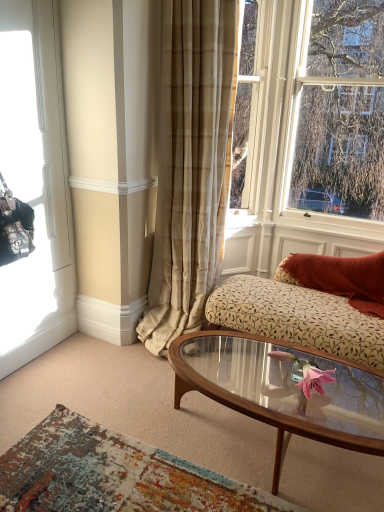
Describe the element at coordinates (35, 183) in the screenshot. I see `black leather handbag at left, the second window when ordered from right to left` at that location.

Locate an element on the screen. Image resolution: width=384 pixels, height=512 pixels. floral-patterned fabric couch at right is located at coordinates (310, 305).

The image size is (384, 512). Describe the element at coordinates (306, 372) in the screenshot. I see `pink glass flower at center` at that location.

Image resolution: width=384 pixels, height=512 pixels. I want to click on black leather handbag at left, positioned as the 1th window in left-to-right order, so click(35, 183).

Could you tell me if black leather handbag at left, positioned as the 1th window in left-to-right order, is facing beige plaid curtain at center?

No, black leather handbag at left, positioned as the 1th window in left-to-right order, is not turned towards beige plaid curtain at center.

At what (x,y) coordinates should I click in order to perform the action: click on curtain that is below the black leather handbag at left, positioned as the 1th window in left-to-right order (from the image's perspective). Please return your answer as a coordinate pair (x, y). The image size is (384, 512). Looking at the image, I should click on (191, 165).

Between black leather handbag at left, the second window when ordered from right to left, and beige plaid curtain at center, which one has larger size?

black leather handbag at left, the second window when ordered from right to left.

Is black leather handbag at left, the second window when ordered from right to left, situated inside beige plaid curtain at center or outside?

black leather handbag at left, the second window when ordered from right to left, exists outside the volume of beige plaid curtain at center.

Is point (350, 207) positioned in front of point (161, 460)?

No, (350, 207) is further to viewer.

Is clear glass window at upper right, the first window in the right-to-left sequence, oriented towards distressed rug at lower left?

Yes, clear glass window at upper right, the first window in the right-to-left sequence, is facing distressed rug at lower left.

Is the depth of clear glass window at upper right, which appears as the second window when viewed from the left, less than that of distressed rug at lower left?

No, it is not.

Are wooden glass coffee table at center and black leather handbag at left, the second window when ordered from right to left, making contact?

No, wooden glass coffee table at center is not beside black leather handbag at left, the second window when ordered from right to left.

Find the location of a particular element. the 1st window directly above the wooden glass coffee table at center (from a real-world perspective) is located at coordinates (35, 183).

Can you confirm if wooden glass coffee table at center is bigger than black leather handbag at left, the second window when ordered from right to left?

No.

Is wooden glass coffee table at center to the left or to the right of black leather handbag at left, the second window when ordered from right to left, in the image?

In the image, wooden glass coffee table at center appears on the right side of black leather handbag at left, the second window when ordered from right to left.

Between pink glass flower at center and clear glass window at upper right, the first window in the right-to-left sequence, which one is positioned behind?

clear glass window at upper right, the first window in the right-to-left sequence, is further away from the camera.

Based on the photo, from the image's perspective, which object appears higher, pink glass flower at center or clear glass window at upper right, which appears as the second window when viewed from the left?

clear glass window at upper right, which appears as the second window when viewed from the left, from the image's perspective.

Considering the sizes of objects pink glass flower at center and clear glass window at upper right, which appears as the second window when viewed from the left, in the image provided, who is thinner, pink glass flower at center or clear glass window at upper right, which appears as the second window when viewed from the left,?

With smaller width is clear glass window at upper right, which appears as the second window when viewed from the left.

Is pink glass flower at center at the right side of clear glass window at upper right, which appears as the second window when viewed from the left?

No.

Is wooden glass coffee table at center thinner than pink glass flower at center?

In fact, wooden glass coffee table at center might be wider than pink glass flower at center.

Is wooden glass coffee table at center taller than pink glass flower at center?

Yes.

How different are the orientations of wooden glass coffee table at center and pink glass flower at center in degrees?

wooden glass coffee table at center and pink glass flower at center are facing 1.56 degrees away from each other.

Choose the correct answer: Is wooden glass coffee table at center inside pink glass flower at center or outside it?

wooden glass coffee table at center is spatially situated outside pink glass flower at center.

Between clear glass window at upper right, which appears as the second window when viewed from the left, and wooden glass coffee table at center, which one has larger size?

With larger size is clear glass window at upper right, which appears as the second window when viewed from the left.

From the picture: Is clear glass window at upper right, which appears as the second window when viewed from the left, taller than wooden glass coffee table at center?

Indeed, clear glass window at upper right, which appears as the second window when viewed from the left, has a greater height compared to wooden glass coffee table at center.

In the scene shown: Is clear glass window at upper right, the first window in the right-to-left sequence, not near wooden glass coffee table at center?

clear glass window at upper right, the first window in the right-to-left sequence, is positioned a significant distance from wooden glass coffee table at center.

Considering the points (353, 183) and (355, 445), which point is in front, point (353, 183) or point (355, 445)?

The point (355, 445) is closer.

In the scene shown: Is beige plaid curtain at center positioned with its back to distressed rug at lower left?

No, beige plaid curtain at center's orientation is not away from distressed rug at lower left.

How many degrees apart are the facing directions of beige plaid curtain at center and distressed rug at lower left?

The facing directions of beige plaid curtain at center and distressed rug at lower left are 89.3 degrees apart.

From a real-world perspective, is beige plaid curtain at center above or below distressed rug at lower left?

Clearly, from a real-world perspective, beige plaid curtain at center is above distressed rug at lower left.

From the image's perspective, between beige plaid curtain at center and distressed rug at lower left, who is located below?

distressed rug at lower left appears lower in the image.

At what (x,y) coordinates should I click in order to perform the action: click on curtain behind the black leather handbag at left, positioned as the 1th window in left-to-right order. Please return your answer as a coordinate pair (x, y). Looking at the image, I should click on (191, 165).

The width and height of the screenshot is (384, 512). Find the location of `window that is on the right side of distressed rug at lower left`. window that is on the right side of distressed rug at lower left is located at coordinates (341, 113).

Estimate the real-world distances between objects in this image. Which object is closer to distressed rug at lower left, floral-patterned fabric couch at right or beige plaid curtain at center?

Among the two, floral-patterned fabric couch at right is located nearer to distressed rug at lower left.

Estimate the real-world distances between objects in this image. Which object is further from wooden glass coffee table at center, floral-patterned fabric couch at right or clear glass window at upper right, the first window in the right-to-left sequence?

clear glass window at upper right, the first window in the right-to-left sequence, is positioned further to the anchor wooden glass coffee table at center.

Based on their spatial positions, is distressed rug at lower left or floral-patterned fabric couch at right further from pink glass flower at center?

Among the two, distressed rug at lower left is located further to pink glass flower at center.

Estimate the real-world distances between objects in this image. Which object is further from distressed rug at lower left, beige plaid curtain at center or wooden glass coffee table at center?

Among the two, beige plaid curtain at center is located further to distressed rug at lower left.

In the scene shown: Based on their spatial positions, is pink glass flower at center or floral-patterned fabric couch at right further from beige plaid curtain at center?

pink glass flower at center is positioned further to the anchor beige plaid curtain at center.

Looking at the image, which one is located closer to distressed rug at lower left, beige plaid curtain at center or black leather handbag at left, positioned as the 1th window in left-to-right order?

black leather handbag at left, positioned as the 1th window in left-to-right order, is positioned closer to the anchor distressed rug at lower left.

When comparing their distances from clear glass window at upper right, the first window in the right-to-left sequence, does distressed rug at lower left or wooden glass coffee table at center seem further?

distressed rug at lower left.

When comparing their distances from wooden glass coffee table at center, does clear glass window at upper right, the first window in the right-to-left sequence, or black leather handbag at left, the second window when ordered from right to left, seem closer?

Based on the image, black leather handbag at left, the second window when ordered from right to left, appears to be nearer to wooden glass coffee table at center.

Identify the location of curtain between clear glass window at upper right, the first window in the right-to-left sequence, and wooden glass coffee table at center in the up-down direction. (191, 165).

Locate an element on the screen. The height and width of the screenshot is (512, 384). flower between clear glass window at upper right, the first window in the right-to-left sequence, and distressed rug at lower left in the up-down direction is located at coordinates (306, 372).

At what (x,y) coordinates should I click in order to perform the action: click on studio couch between clear glass window at upper right, which appears as the second window when viewed from the left, and wooden glass coffee table at center from top to bottom. Please return your answer as a coordinate pair (x, y). This screenshot has width=384, height=512. Looking at the image, I should click on (310, 305).

Locate an element on the screen. curtain between black leather handbag at left, the second window when ordered from right to left, and clear glass window at upper right, the first window in the right-to-left sequence is located at coordinates (191, 165).